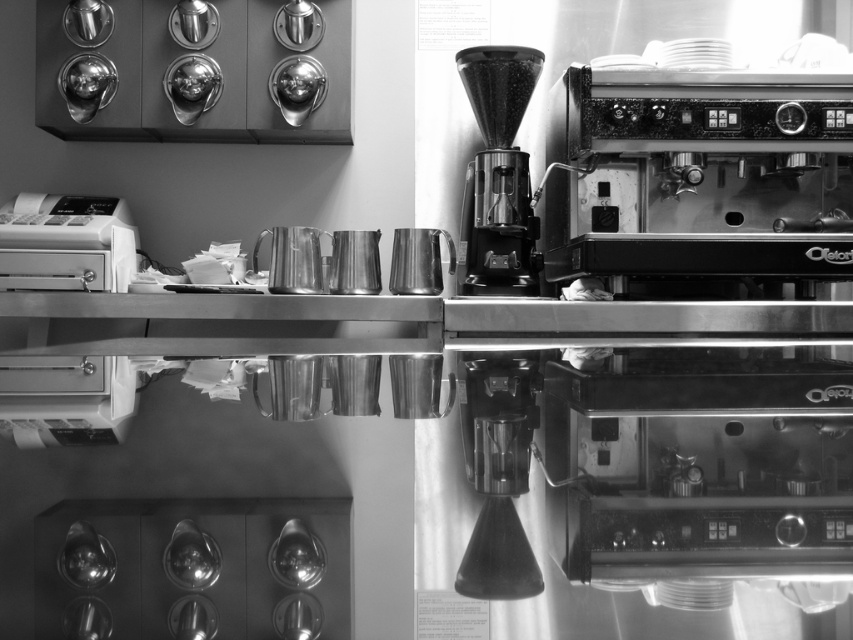
Question: Does white plastic cash register at left have a greater width compared to metallic black coffee grinder at center?

Choices:
 (A) no
 (B) yes

Answer: (B)

Question: Which object is positioned farthest from the metallic black coffee grinder at center?

Choices:
 (A) metallic cylindrical filter at center
 (B) metallic stainless steel espresso machine at right

Answer: (A)

Question: Which object appears closest to the camera in this image?

Choices:
 (A) metallic cylindrical filter at center
 (B) white plastic cash register at left

Answer: (A)

Question: Which of the following is the closest to the observer?

Choices:
 (A) metallic cylindrical filter at center
 (B) metallic black coffee grinder at center
 (C) white plastic cash register at left
 (D) metallic stainless steel espresso machine at right

Answer: (A)

Question: Does metallic stainless steel espresso machine at right appear under metallic black coffee grinder at center?

Choices:
 (A) no
 (B) yes

Answer: (B)

Question: Does white plastic cash register at left appear on the right side of metallic cylindrical filter at center?

Choices:
 (A) no
 (B) yes

Answer: (A)